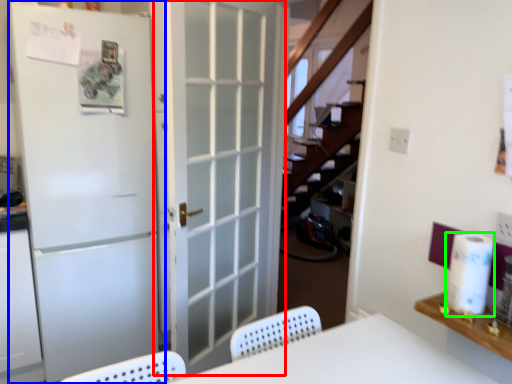
Question: Which object is positioned closest to door (highlighted by a red box)? Select from door (highlighted by a blue box) and paper towel (highlighted by a green box).

Choices:
 (A) door
 (B) paper towel

Answer: (A)